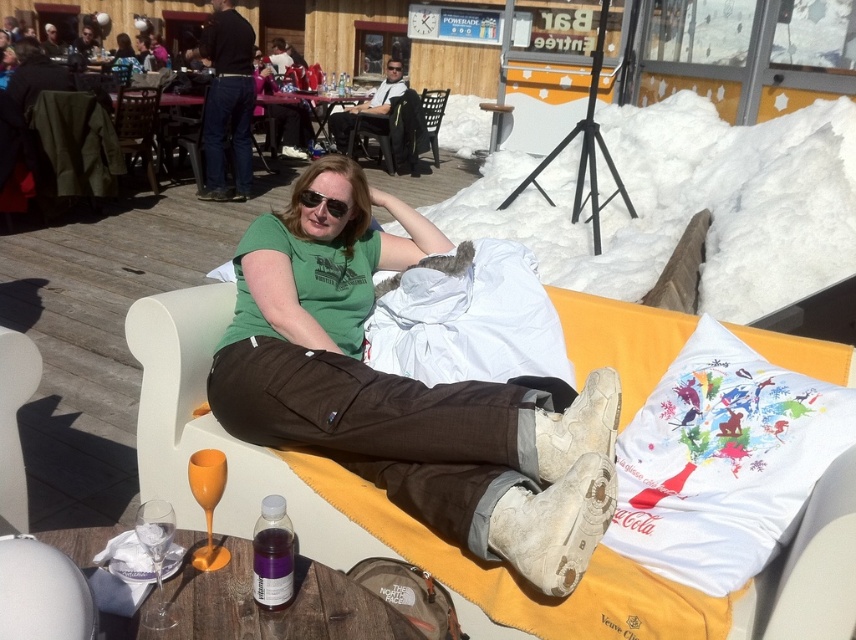
The user is standing at the point marked as point (722,461) and wants to place a small bag on the table. Is there enough space on the table to accommodate the bag?

The point (722,461) is where the white fabric pillow at lower right is located, so placing the small bag there would not be possible as the pillow occupies that space.

You are a photographer setting up a tripod in this scene. You need to place the tripod between the white fabric pillow at lower right and the black plastic sunglasses at center. Which object should you position the tripod closer to if you want to ensure it doesn

The white fabric pillow at lower right might be wider than the black plastic sunglasses at center, so positioning the tripod closer to the white fabric pillow at lower right would provide a more stable base due to its wider surface area.

You are standing in the outdoor area of a ski resort and see two points marked in the scene. Which point is closer to you, point [361,529] or point [724,563]?

Point [361,529] is closer to you because it is further to the viewer than point [724,563].